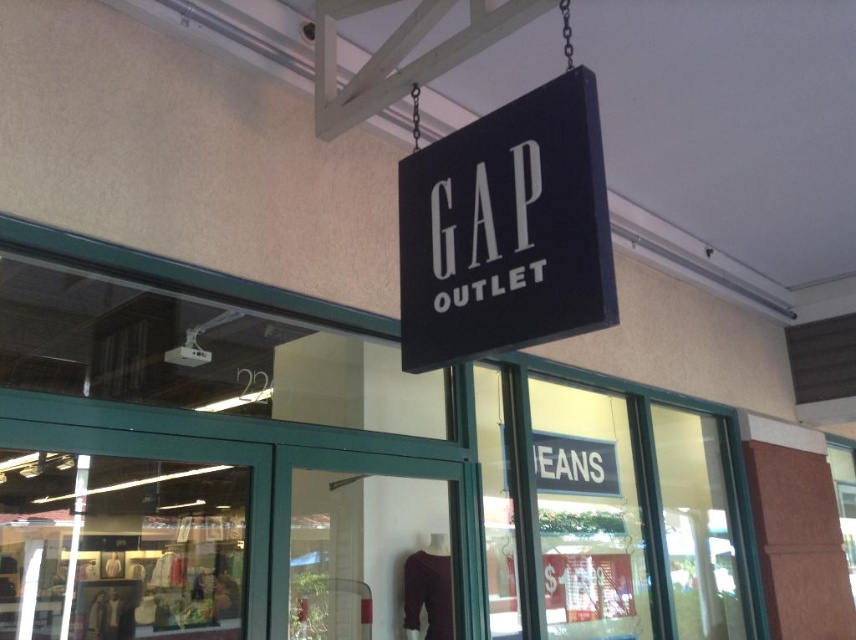
You are a delivery person trying to enter the store through the matte glass door at center. The black matte sign at center is blocking your path. Can you walk around the sign to reach the door?

The black matte sign at center is thinner than the matte glass door at center, so you can walk around the sign to reach the matte glass door at center since it has a narrower width.

You are standing outside the store and want to enter. The black matte sign at center and the matte glass door at center are both in front of you. Which object is closer to you?

The matte glass door at center is closer to you because the black matte sign at center occupies less space than it, indicating it is further away.

Looking at this image, you are a customer standing in front of the store entrance. You want to enter the store through the matte glass door at center. Which side of the black matte sign at center should you walk around to reach the door?

The black matte sign at center is positioned on the right side of the matte glass door at center, so you should walk around the left side of the black matte sign at center to reach the door.